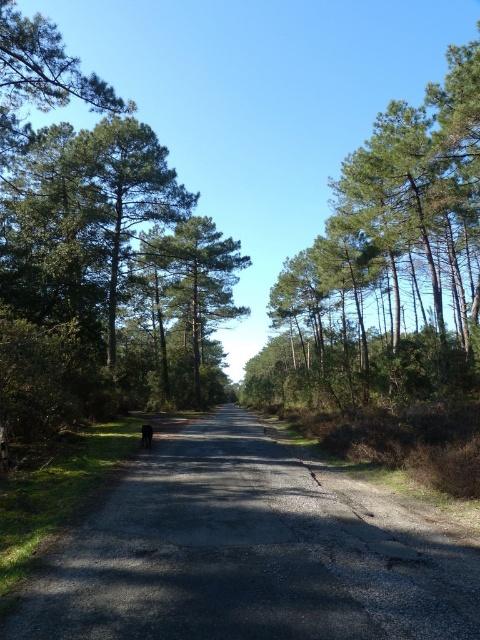
Question: Can you confirm if dirt road at center is thinner than green matte tree at center?

Choices:
 (A) yes
 (B) no

Answer: (A)

Question: In this image, where is dirt road at center located relative to green matte tree at center?

Choices:
 (A) left
 (B) right

Answer: (B)

Question: Which of the following is the farthest from the observer?

Choices:
 (A) (222, 307)
 (B) (165, 468)

Answer: (A)

Question: Among these objects, which one is nearest to the camera?

Choices:
 (A) dirt road at center
 (B) green leafy tree at upper right
 (C) green matte tree at center

Answer: (A)

Question: Among these objects, which one is farthest from the camera?

Choices:
 (A) dirt road at center
 (B) green leafy tree at upper right
 (C) green matte tree at center

Answer: (C)

Question: Can you confirm if dirt road at center is thinner than green leafy tree at upper right?

Choices:
 (A) no
 (B) yes

Answer: (B)